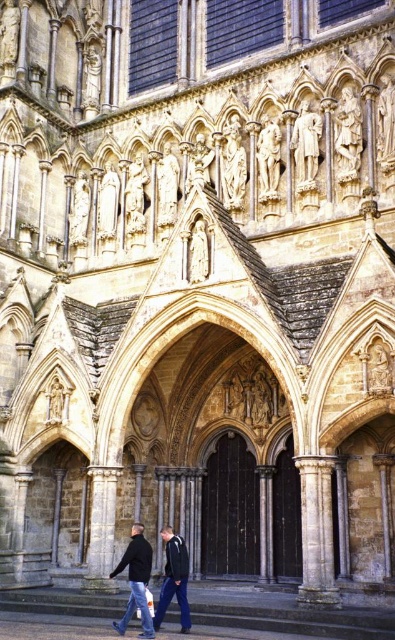
You are standing in front of the Gothic cathedral and notice a dark blue jacket at center. Based on its position, can you determine if it is placed near the top or bottom of the facade?

The dark blue jacket at center is located at point coordinates indicating it is near the bottom of the facade since its y coordinate is 0.441, which is less than 0.5.

You are a tourist standing in front of the cathedral. You notice a dark gray jacket at center and a stone statue at center. Which object is positioned higher up on the cathedral facade?

The stone statue at center is positioned higher up on the cathedral facade than the dark gray jacket at center.